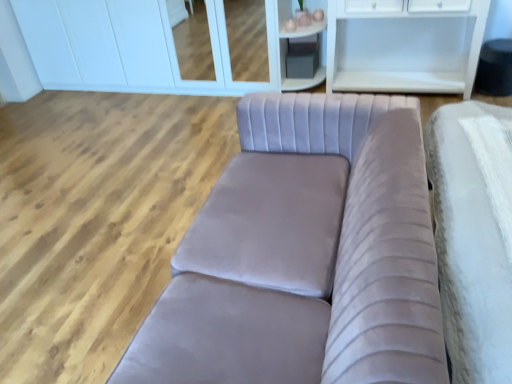
The height and width of the screenshot is (384, 512). I want to click on vacant space in front of white glossy cabinet at upper center, so (132, 147).